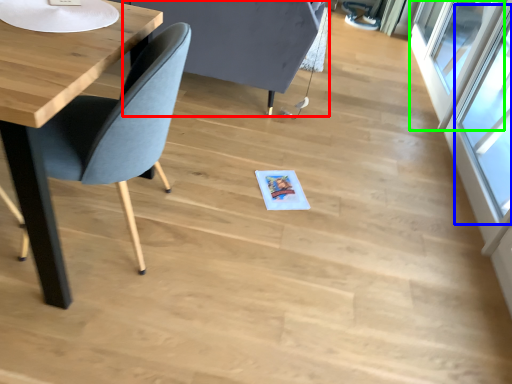
Question: Which is nearer to the swivel chair (highlighted by a red box)? window (highlighted by a blue box) or window (highlighted by a green box).

Choices:
 (A) window
 (B) window

Answer: (A)